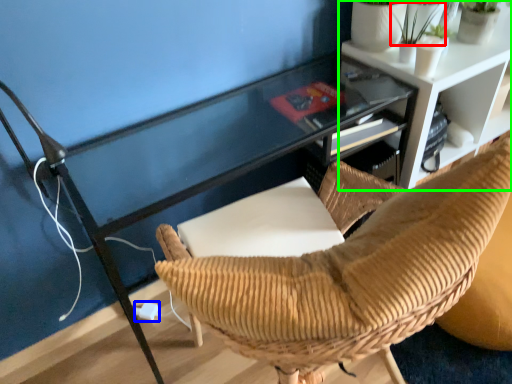
Question: Which object is the farthest from plant (highlighted by a red box)? Choose among these: plug (highlighted by a blue box) or shelf (highlighted by a green box).

Choices:
 (A) plug
 (B) shelf

Answer: (A)